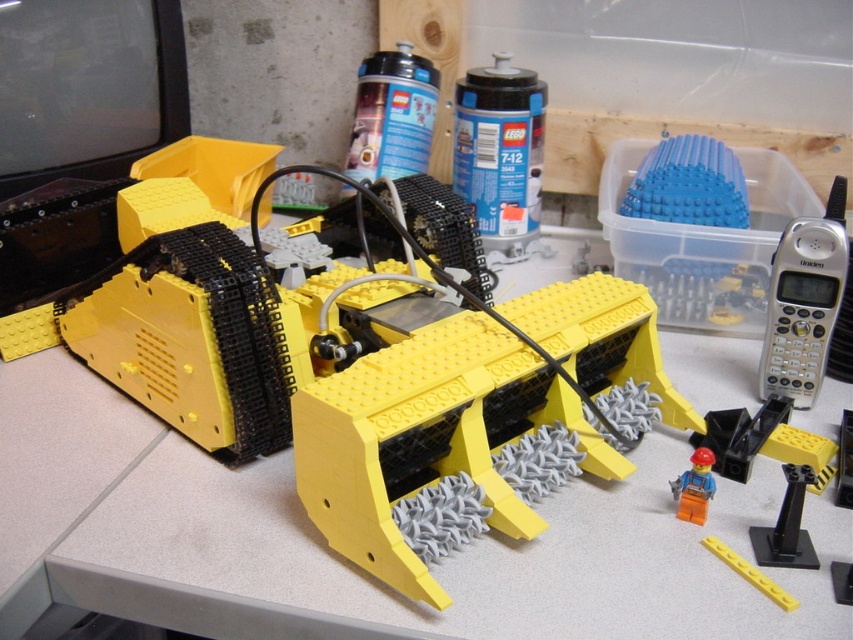
Which of these two, silver metallic phone at right or matte black spray can at upper center, stands taller?

silver metallic phone at right is taller.

The width and height of the screenshot is (853, 640). Find the location of `silver metallic phone at right`. silver metallic phone at right is located at coordinates (804, 301).

Which is in front, point (785, 250) or point (428, 88)?

Point (785, 250) is in front.

Identify the location of silver metallic phone at right. (804, 301).

Can you confirm if yellow plastic toy at center is bigger than matte black spray can at upper center?

Yes.

Who is more distant from viewer, (x=457, y=509) or (x=396, y=125)?

The point (x=396, y=125) is behind.

Does point (250, 310) come farther from viewer compared to point (421, 104)?

No, (250, 310) is in front of (421, 104).

Where is `yellow plastic toy at center`? yellow plastic toy at center is located at coordinates (364, 378).

Which is above, matte black spray can at upper center or orange matte figure at lower right?

Positioned higher is matte black spray can at upper center.

Who is lower down, matte black spray can at upper center or orange matte figure at lower right?

orange matte figure at lower right is lower down.

The image size is (853, 640). What do you see at coordinates (392, 115) in the screenshot?
I see `matte black spray can at upper center` at bounding box center [392, 115].

Where is `matte black spray can at upper center`? Image resolution: width=853 pixels, height=640 pixels. matte black spray can at upper center is located at coordinates (392, 115).